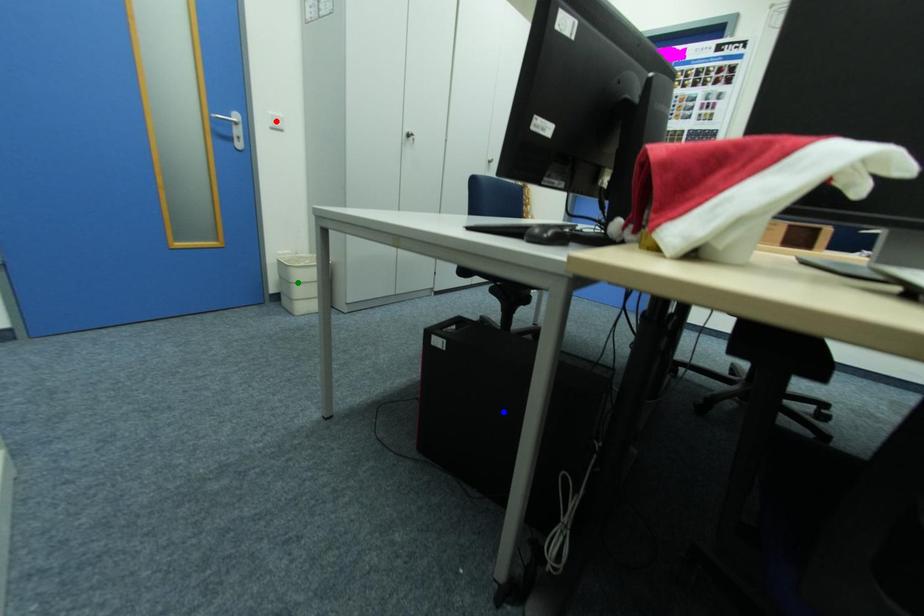
Order these from nearest to farthest:
A) blue point
B) green point
C) red point

blue point
green point
red point